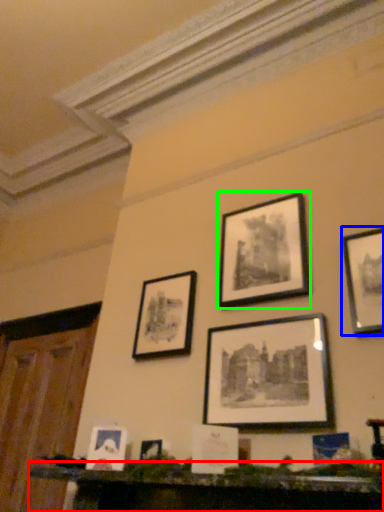
Question: Based on their relative distances, which object is nearer to furniture (highlighted by a red box)? Choose from picture frame (highlighted by a blue box) and picture frame (highlighted by a green box).

Choices:
 (A) picture frame
 (B) picture frame

Answer: (A)